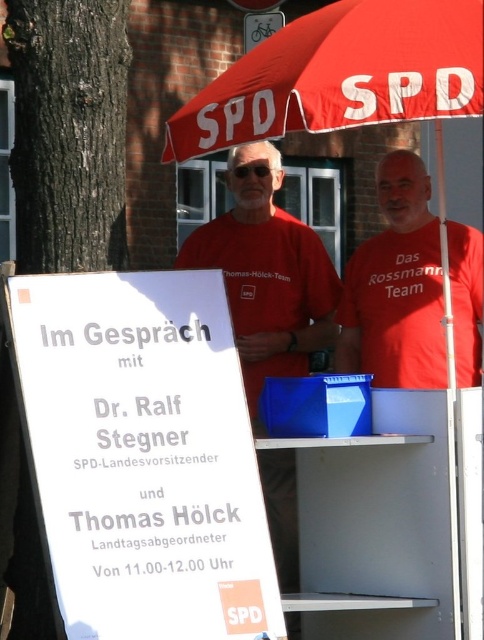
Question: Estimate the real-world distances between objects in this image. Which object is farther from the red fabric umbrella at upper center?

Choices:
 (A) matte red shirt at center
 (B) matte red t-shirt at center

Answer: (A)

Question: Is the position of red fabric umbrella at upper center less distant than that of matte red t-shirt at center?

Choices:
 (A) no
 (B) yes

Answer: (B)

Question: Which of the following is the farthest from the observer?

Choices:
 (A) (386, 328)
 (B) (295, 564)

Answer: (A)

Question: Is matte red shirt at center above matte red t-shirt at center?

Choices:
 (A) no
 (B) yes

Answer: (A)

Question: Is red fabric umbrella at upper center closer to camera compared to matte red t-shirt at center?

Choices:
 (A) no
 (B) yes

Answer: (B)

Question: Which point appears closest to the camera in this image?

Choices:
 (A) (428, 352)
 (B) (288, 483)

Answer: (A)